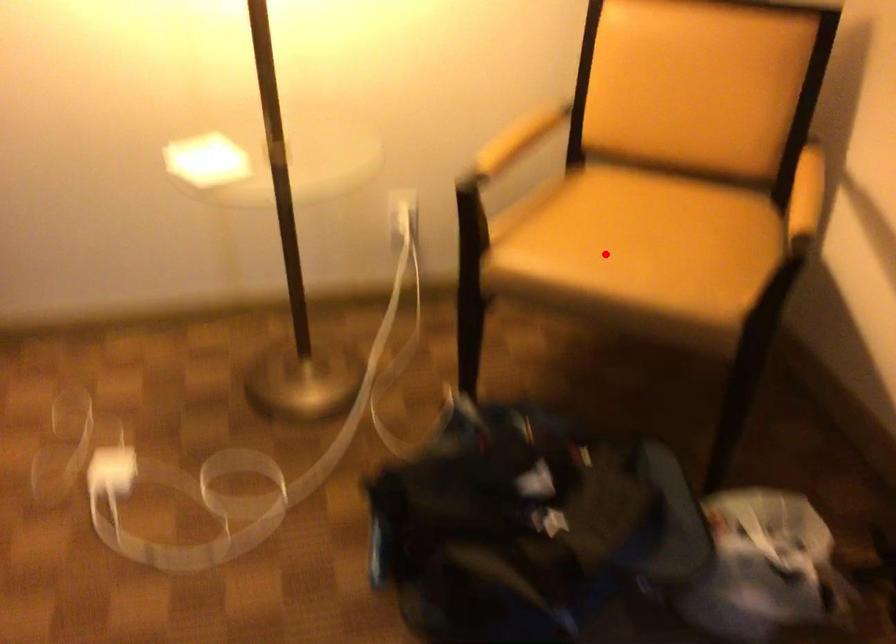
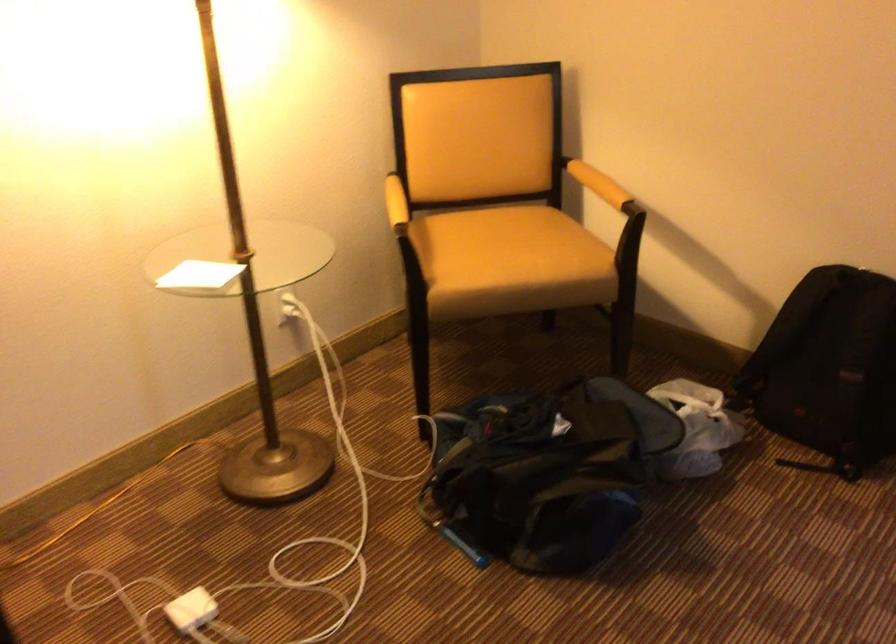
Where in the second image is the point corresponding to the highlighted location from the first image?

(510, 261)